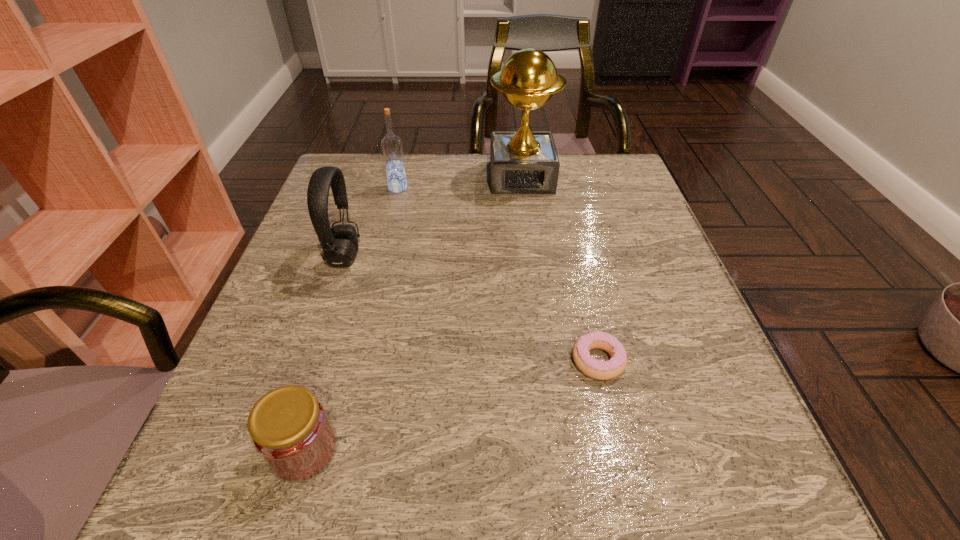
The image size is (960, 540). What are the coordinates of `free spot between the vodka and the fourth tallest object` in the screenshot? It's located at (351, 319).

Identify the location of vacant space in between the fourth farthest object and the award. (560, 269).

Locate an element on the screen. This screenshot has height=540, width=960. vacant area that lies between the third nearest object and the tallest object is located at coordinates (433, 217).

Find the location of a particular element. The height and width of the screenshot is (540, 960). unoccupied position between the vodka and the second shortest object is located at coordinates (351, 319).

You are a GUI agent. You are given a task and a screenshot of the screen. Output one action in this format:
    pyautogui.click(x=<x>, y=<y>)
    Task: Click on the vacant space that's between the tallest object and the headset
    The height and width of the screenshot is (540, 960).
    Given the screenshot: What is the action you would take?
    pyautogui.click(x=433, y=217)

Locate which object is the closest to the doughnut. Please provide its 2D coordinates. Your answer should be formatted as a tuple, i.e. [(x, y)], where the tuple contains the x and y coordinates of a point satisfying the conditions above.

[(289, 427)]

You are a GUI agent. You are given a task and a screenshot of the screen. Output one action in this format:
    pyautogui.click(x=<x>, y=<y>)
    Task: Click on the object that can be found as the closest to the tallest object
    Image resolution: width=960 pixels, height=540 pixels.
    Given the screenshot: What is the action you would take?
    click(x=391, y=145)

What are the coordinates of `vacant area that satisfies the following two spatial constraints: 1. on the front-facing side of the nearest object; 2. on the right side of the headset` in the screenshot? It's located at (279, 450).

You are a GUI agent. You are given a task and a screenshot of the screen. Output one action in this format:
    pyautogui.click(x=<x>, y=<y>)
    Task: Click on the vacant space that satisfies the following two spatial constraints: 1. on the back side of the nearest object; 2. on the front-facing side of the third farthest object
    This screenshot has height=540, width=960.
    Given the screenshot: What is the action you would take?
    pyautogui.click(x=361, y=256)

Where is `vacant space that satisfies the following two spatial constraints: 1. on the front-facing side of the third farthest object; 2. on the back side of the second shortest object`? The image size is (960, 540). vacant space that satisfies the following two spatial constraints: 1. on the front-facing side of the third farthest object; 2. on the back side of the second shortest object is located at coordinates (279, 450).